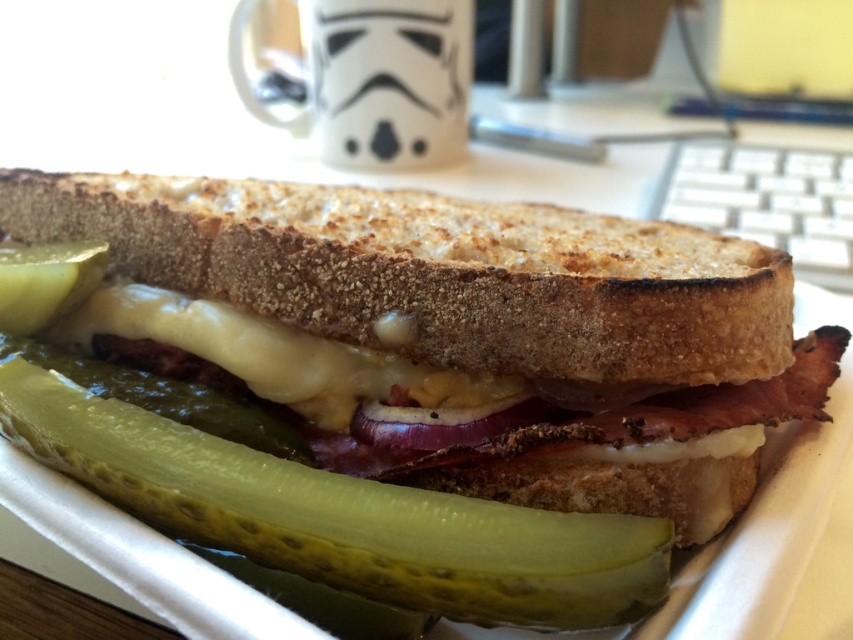
Question: Which of the following is the farthest from the observer?

Choices:
 (A) toasted bread at center
 (B) white ceramic mug at upper center
 (C) green pickled vegetable at center
 (D) white melted cheese at center

Answer: (B)

Question: Which of these objects is positioned farthest from the toasted bread at center?

Choices:
 (A) white melted cheese at center
 (B) white ceramic mug at upper center
 (C) green pickled vegetable at center

Answer: (B)

Question: Which of the following is the closest to the observer?

Choices:
 (A) green pickled vegetable at center
 (B) white ceramic mug at upper center
 (C) white melted cheese at center
 (D) toasted bread at center

Answer: (A)

Question: Does toasted bread at center appear on the left side of white melted cheese at center?

Choices:
 (A) no
 (B) yes

Answer: (A)

Question: Considering the relative positions of green pickled vegetable at center and white melted cheese at center in the image provided, where is green pickled vegetable at center located with respect to white melted cheese at center?

Choices:
 (A) left
 (B) right

Answer: (B)

Question: Is green pickled vegetable at center above white melted cheese at center?

Choices:
 (A) yes
 (B) no

Answer: (B)